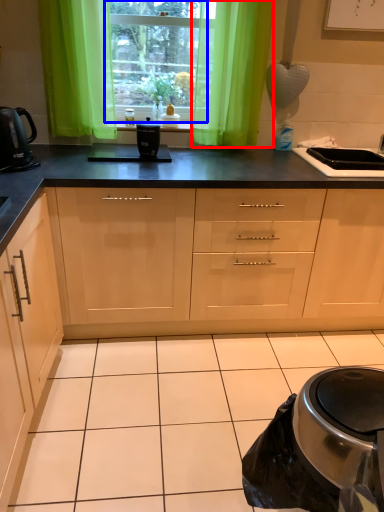
Question: Which of the following is the closest to the observer, curtain (highlighted by a red box) or window (highlighted by a blue box)?

Choices:
 (A) curtain
 (B) window

Answer: (A)